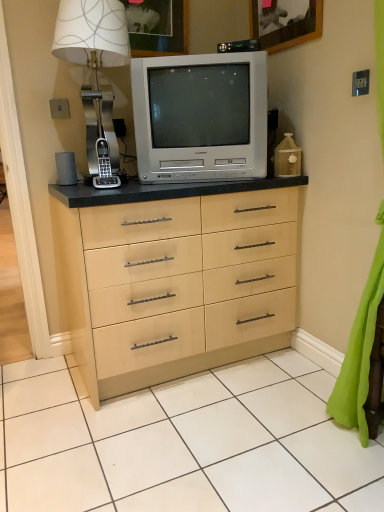
Question: Does green fabric curtain at lower right have a lesser height compared to metallic silver table lamp at upper left?

Choices:
 (A) no
 (B) yes

Answer: (A)

Question: Can you confirm if green fabric curtain at lower right is positioned to the left of metallic silver table lamp at upper left?

Choices:
 (A) yes
 (B) no

Answer: (B)

Question: From the image's perspective, is green fabric curtain at lower right on metallic silver table lamp at upper left?

Choices:
 (A) yes
 (B) no

Answer: (B)

Question: Can you confirm if green fabric curtain at lower right is bigger than metallic silver table lamp at upper left?

Choices:
 (A) no
 (B) yes

Answer: (B)

Question: Does green fabric curtain at lower right come in front of metallic silver table lamp at upper left?

Choices:
 (A) no
 (B) yes

Answer: (B)

Question: Is wooden picture frame at upper center, the 1th picture frame in the right-to-left sequence, bigger or smaller than black plastic phone at left?

Choices:
 (A) big
 (B) small

Answer: (A)

Question: From the image's perspective, is wooden picture frame at upper center, the 1th picture frame in the right-to-left sequence, located above or below black plastic phone at left?

Choices:
 (A) below
 (B) above

Answer: (B)

Question: From a real-world perspective, is wooden picture frame at upper center, the 2th picture frame when ordered from left to right, above or below black plastic phone at left?

Choices:
 (A) above
 (B) below

Answer: (A)

Question: Considering the relative positions of wooden picture frame at upper center, the 1th picture frame in the right-to-left sequence, and black plastic phone at left in the image provided, is wooden picture frame at upper center, the 1th picture frame in the right-to-left sequence, to the left or to the right of black plastic phone at left?

Choices:
 (A) right
 (B) left

Answer: (A)

Question: Is silver metallic television at center spatially inside metallic silver table lamp at upper left, or outside of it?

Choices:
 (A) outside
 (B) inside

Answer: (A)

Question: Visually, is silver metallic television at center positioned to the left or to the right of metallic silver table lamp at upper left?

Choices:
 (A) left
 (B) right

Answer: (B)

Question: From the image's perspective, is silver metallic television at center positioned above or below metallic silver table lamp at upper left?

Choices:
 (A) above
 (B) below

Answer: (B)

Question: From a real-world perspective, is silver metallic television at center physically located above or below metallic silver table lamp at upper left?

Choices:
 (A) below
 (B) above

Answer: (A)

Question: In the image, is silver metallic television at center on the left side or the right side of wooden picture frame at upper center, the 2th picture frame when ordered from left to right?

Choices:
 (A) right
 (B) left

Answer: (B)

Question: From the image's perspective, is silver metallic television at center positioned above or below wooden picture frame at upper center, the 1th picture frame in the right-to-left sequence?

Choices:
 (A) above
 (B) below

Answer: (B)